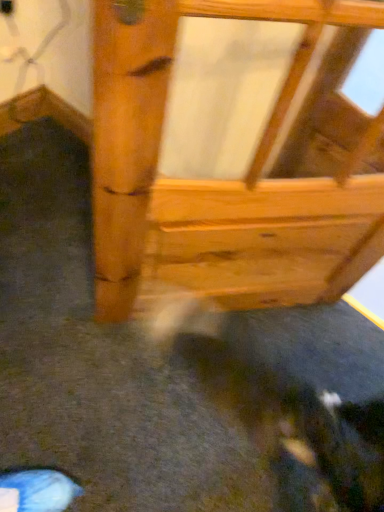
Where is `free spot to the left of natural wood drawer at center`? This screenshot has height=512, width=384. free spot to the left of natural wood drawer at center is located at coordinates (72, 295).